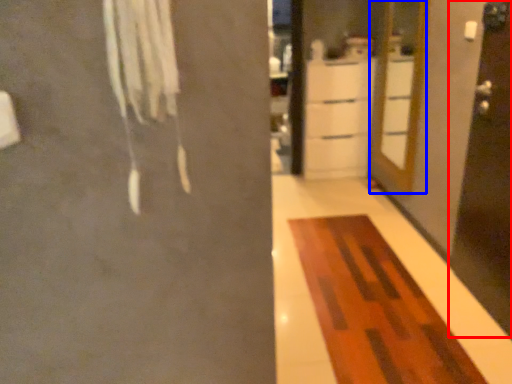
Question: Which point is closer to the camera, screen door (highlighted by a red box) or door (highlighted by a blue box)?

Choices:
 (A) screen door
 (B) door

Answer: (A)